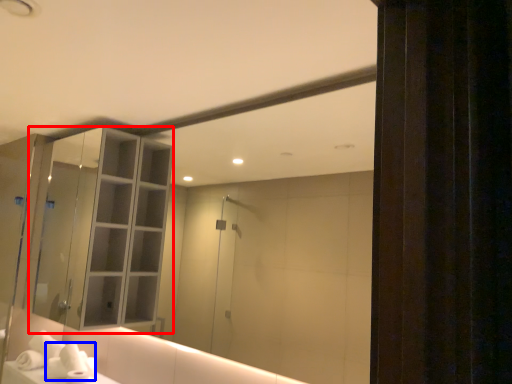
Question: Which object is further to the camera taking this photo, cabinetry (highlighted by a red box) or hand towel (highlighted by a blue box)?

Choices:
 (A) cabinetry
 (B) hand towel

Answer: (B)